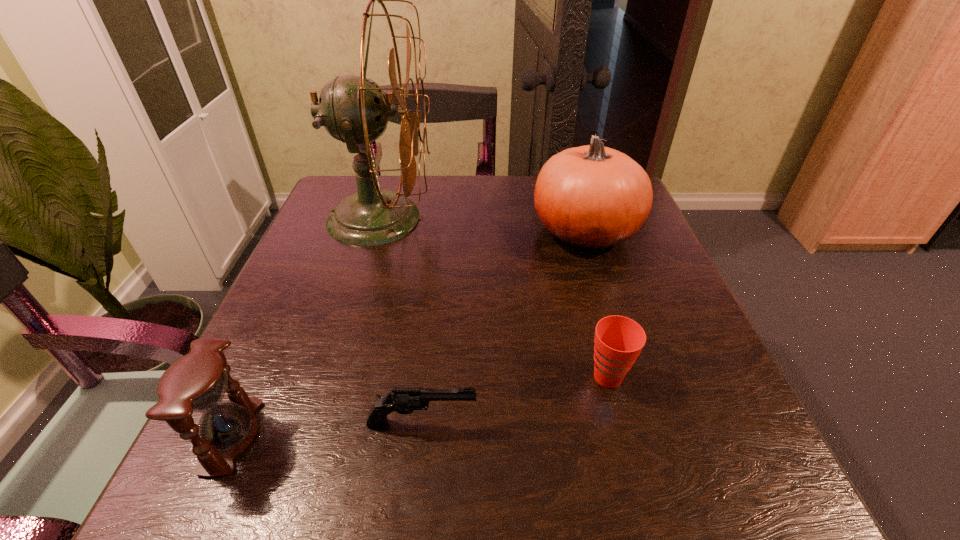
Where is `object situated at the far right corner`? object situated at the far right corner is located at coordinates (591, 197).

In the image, there is a desktop. Where is `free space at the far edge`? free space at the far edge is located at coordinates (429, 216).

Where is `blank space at the near edge of the desktop`? blank space at the near edge of the desktop is located at coordinates (548, 496).

I want to click on vacant region at the left edge of the desktop, so click(x=346, y=264).

Find the location of `free space at the right edge of the desktop`. free space at the right edge of the desktop is located at coordinates (598, 296).

Find the location of a particular element. The image size is (960, 540). free region at the far left corner is located at coordinates (349, 188).

In order to click on vacant area that lies between the tallest object and the second shortest object in this screenshot , I will do `click(493, 298)`.

The width and height of the screenshot is (960, 540). Identify the location of free space between the pumpkin and the gun. (504, 328).

Locate an element on the screen. The image size is (960, 540). free space between the fan and the third tallest object is located at coordinates (305, 327).

I want to click on blank region between the fourth shortest object and the second shortest object, so click(x=596, y=305).